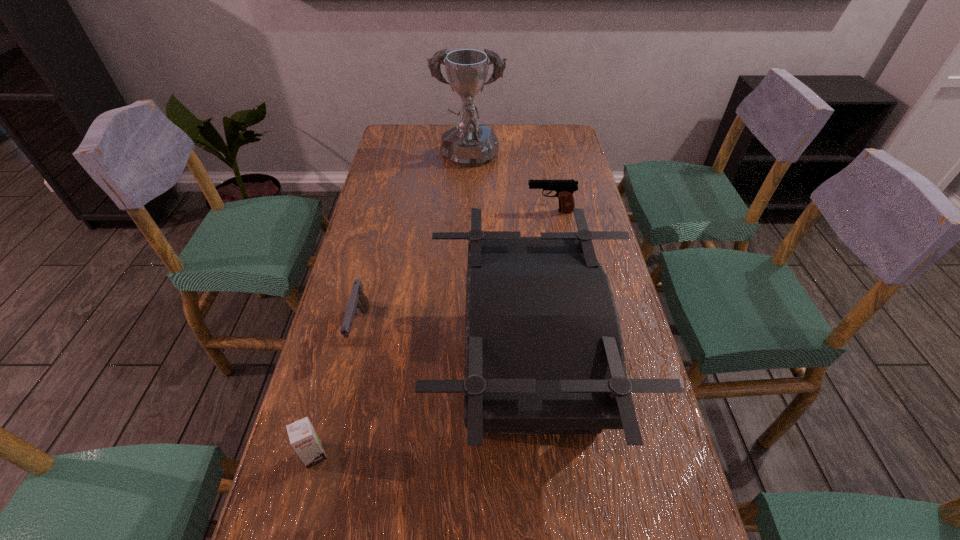
You are a GUI agent. You are given a task and a screenshot of the screen. Output one action in this format:
    pyautogui.click(x=<x>, y=<y>)
    Task: Click on the pistol present at the right edge
    This screenshot has height=540, width=960.
    Given the screenshot: What is the action you would take?
    click(564, 189)

This screenshot has width=960, height=540. In the image, there is a desktop. In order to click on free region at the far edge in this screenshot , I will do `click(490, 124)`.

In the image, there is a desktop. Where is `vacant space at the left edge`? This screenshot has width=960, height=540. vacant space at the left edge is located at coordinates (398, 264).

At what (x,y) coordinates should I click in order to perform the action: click on free space at the right edge. Please return your answer as a coordinate pair (x, y). This screenshot has width=960, height=540. Looking at the image, I should click on (564, 160).

This screenshot has height=540, width=960. What are the coordinates of `vacant area at the far left corner` in the screenshot? It's located at (392, 147).

This screenshot has height=540, width=960. What are the coordinates of `vacant area at the far right corner` in the screenshot? It's located at (572, 127).

You are a GUI agent. You are given a task and a screenshot of the screen. Output one action in this format:
    pyautogui.click(x=<x>, y=<y>)
    Task: Click on the free area in between the farthest object and the fourth nearest object
    Image resolution: width=960 pixels, height=540 pixels.
    Given the screenshot: What is the action you would take?
    pyautogui.click(x=509, y=186)

Where is `empty location between the fourth nearest object and the chocolate milk`? The height and width of the screenshot is (540, 960). empty location between the fourth nearest object and the chocolate milk is located at coordinates (432, 333).

You are a GUI agent. You are given a task and a screenshot of the screen. Output one action in this format:
    pyautogui.click(x=<x>, y=<y>)
    Task: Click on the vacant space that is in between the left pistol and the second tallest object
    
    Given the screenshot: What is the action you would take?
    pyautogui.click(x=444, y=348)

The height and width of the screenshot is (540, 960). Identify the location of free space between the second tallest object and the nearer pistol. (444, 348).